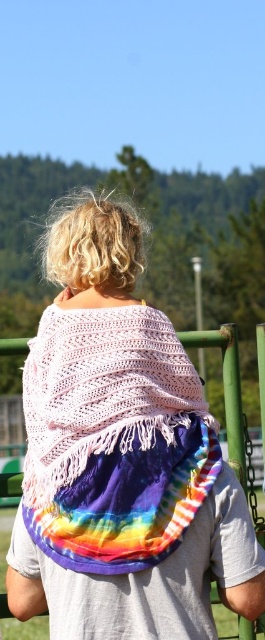
You are a photographer trying to capture the intricate pattern of the tie dye fabric at center. You notice a point at coordinates (x=121, y=456). Is this point located on the tie dye fabric at center?

Yes, the point at coordinates (x=121, y=456) is located on the tie dye fabric at center as stated in the description.